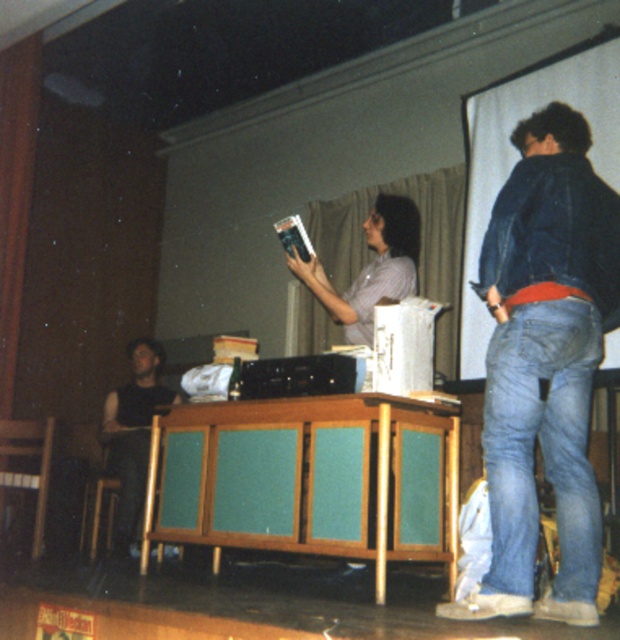
Is green fabric curtain at upper center thinner than black sleeveless shirt at left?

No, green fabric curtain at upper center is not thinner than black sleeveless shirt at left.

From the picture: Can you confirm if green fabric curtain at upper center is positioned to the left of black sleeveless shirt at left?

No, green fabric curtain at upper center is not to the left of black sleeveless shirt at left.

Does point (299, 323) come closer to viewer compared to point (169, 390)?

No, (299, 323) is further to viewer.

Locate an element on the screen. The height and width of the screenshot is (640, 620). green fabric curtain at upper center is located at coordinates (418, 244).

Is denim jeans at right below woodengreen panelled cabinet at center?

Actually, denim jeans at right is above woodengreen panelled cabinet at center.

Is point (569, 220) positioned behind point (314, 419)?

No, it is not.

Where is `denim jeans at right`? Image resolution: width=620 pixels, height=640 pixels. denim jeans at right is located at coordinates coord(544,365).

The height and width of the screenshot is (640, 620). I want to click on denim jeans at right, so click(x=544, y=365).

Where is `denim jeans at right`? This screenshot has height=640, width=620. denim jeans at right is located at coordinates click(x=544, y=365).